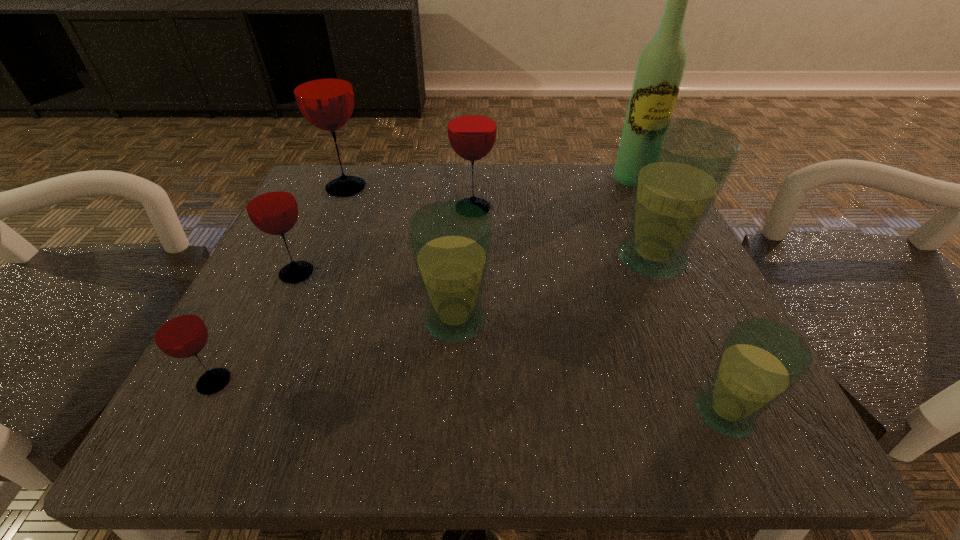
The width and height of the screenshot is (960, 540). I want to click on wine bottle situated at the right edge, so click(x=659, y=73).

At what (x,y) coordinates should I click in order to perform the action: click on object located at the far left corner. Please return your answer as a coordinate pair (x, y). This screenshot has height=540, width=960. Looking at the image, I should click on [322, 87].

This screenshot has width=960, height=540. I want to click on object present at the near left corner, so click(178, 331).

Find the location of a particular element. Image resolution: width=960 pixels, height=540 pixels. object at the far right corner is located at coordinates (659, 73).

Where is `object that is positioned at the near right corner`? The image size is (960, 540). object that is positioned at the near right corner is located at coordinates (761, 360).

Image resolution: width=960 pixels, height=540 pixels. I want to click on blank space at the far edge, so click(489, 184).

You are a GUI agent. You are given a task and a screenshot of the screen. Output one action in this format:
    pyautogui.click(x=<x>, y=<y>)
    Task: Click on the vacant position at the near edge of the desktop
    
    Given the screenshot: What is the action you would take?
    pyautogui.click(x=324, y=395)

Image resolution: width=960 pixels, height=540 pixels. Find the location of `free space at the left edge of the desktop`. free space at the left edge of the desktop is located at coordinates tap(330, 242).

Identify the location of vacant space at the right edge. The image size is (960, 540). (640, 300).

Find the location of a particular element. Image resolution: width=960 pixels, height=540 pixels. blank space at the near left corner of the desktop is located at coordinates (246, 439).